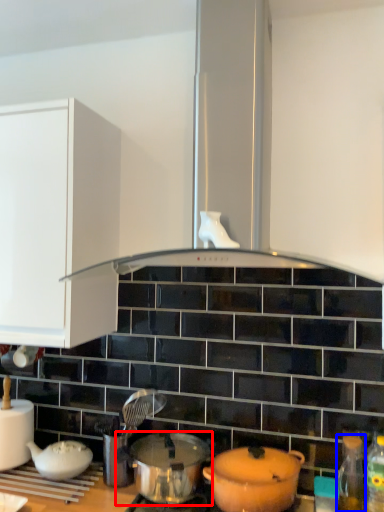
Question: Which of the following is the farthest to the observer, pot/pan (highlighted by a red box) or bottle (highlighted by a blue box)?

Choices:
 (A) pot/pan
 (B) bottle

Answer: (B)